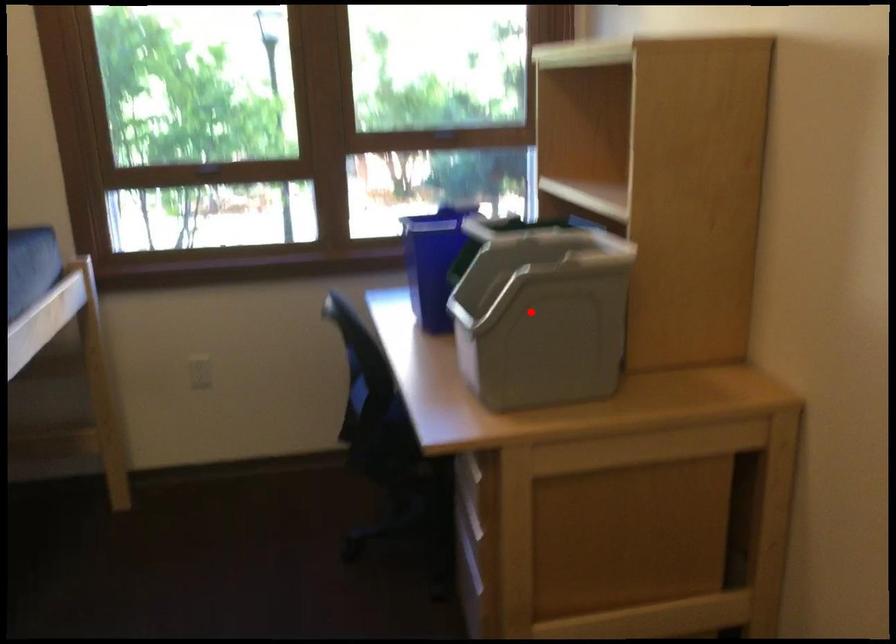
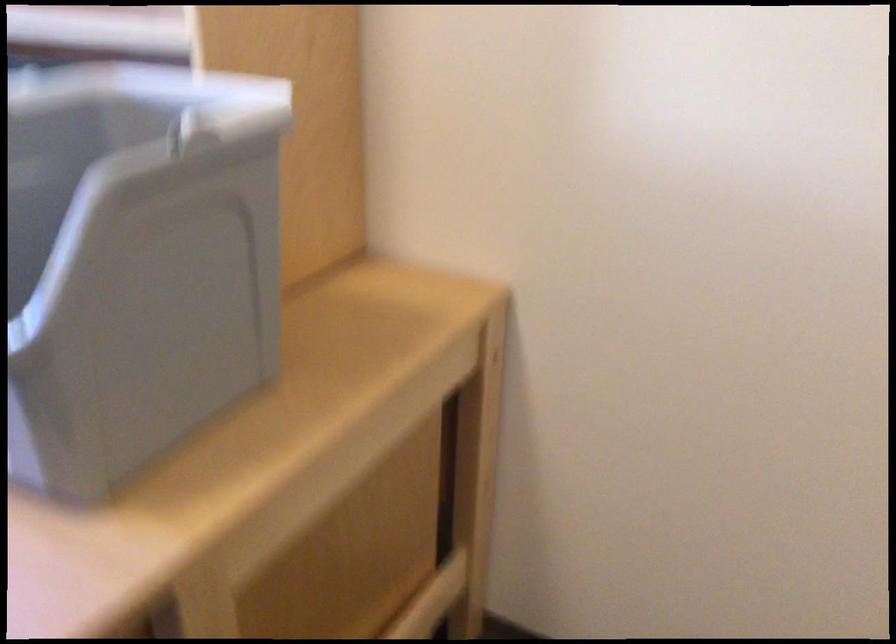
Find the pixel in the second image that matches the highlighted location in the first image.

(135, 263)